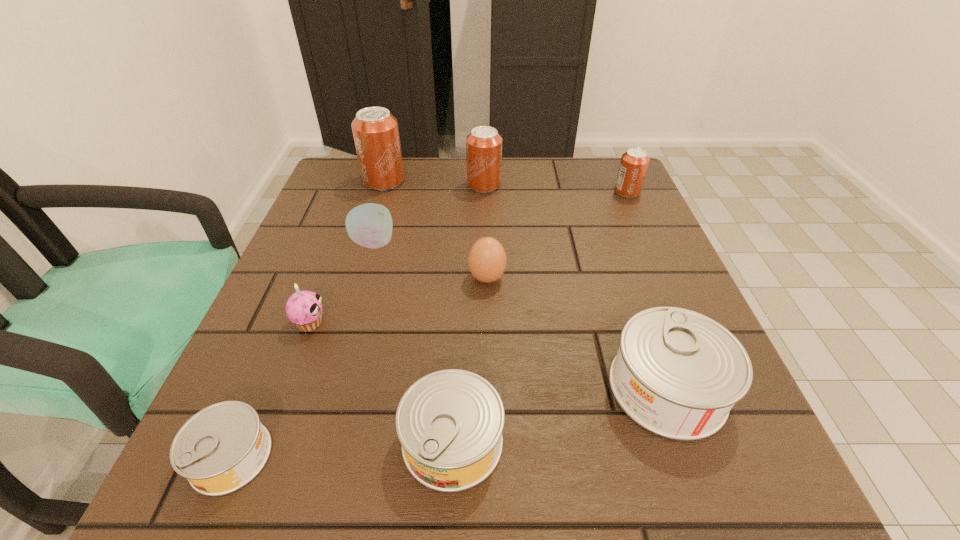
The width and height of the screenshot is (960, 540). I want to click on blank space at the near edge of the desktop, so click(613, 496).

Where is `vacant area at the left edge of the desktop`? This screenshot has height=540, width=960. vacant area at the left edge of the desktop is located at coordinates (327, 300).

Find the location of `free space at the right edge of the desktop`. free space at the right edge of the desktop is located at coordinates [636, 266].

The width and height of the screenshot is (960, 540). What are the coordinates of `vacant space at the far left corner` in the screenshot? It's located at (340, 190).

Find the location of `vacant region at the far right corner`. vacant region at the far right corner is located at coordinates (600, 172).

Where is `free spot between the leftmost silver can and the fourth farthest object`? free spot between the leftmost silver can and the fourth farthest object is located at coordinates 302,349.

You are a GUI agent. You are given a task and a screenshot of the screen. Output one action in this format:
    pyautogui.click(x=<x>, y=<y>)
    Task: Click on the empty space between the rightmost silver can and the second shortest object
    Image resolution: width=960 pixels, height=540 pixels.
    Given the screenshot: What is the action you would take?
    pyautogui.click(x=560, y=414)

At what (x,y) coordinates should I click in order to perform the action: click on free spot between the second shortest can and the smallest silver can. Please return your answer as a coordinate pair (x, y). Looking at the image, I should click on pyautogui.click(x=342, y=448).

I want to click on vacant space that's between the biggest orange can and the fourth nearest object, so click(x=347, y=252).

Image resolution: width=960 pixels, height=540 pixels. I want to click on vacant area that lies between the smallest orange can and the rightmost silver can, so click(647, 290).